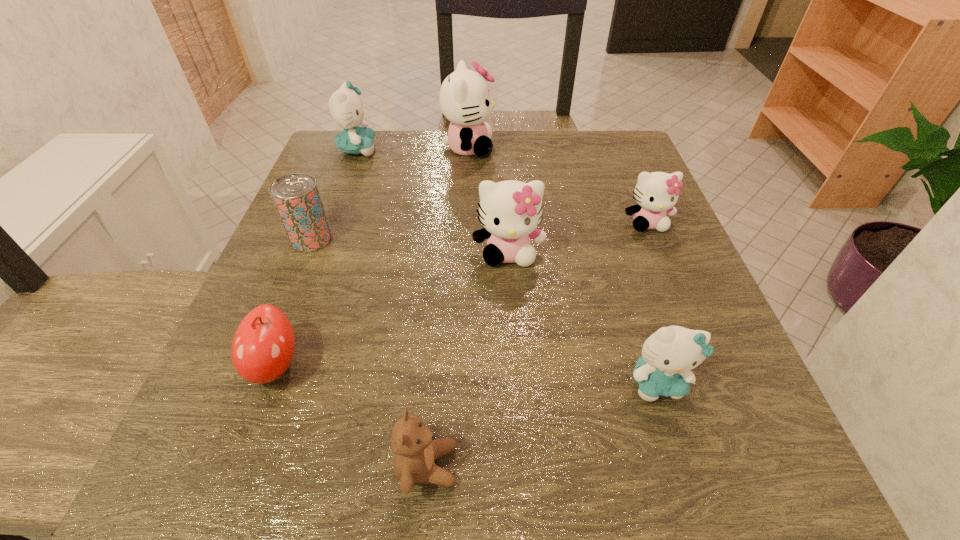
This screenshot has width=960, height=540. Find the location of `free spot between the smallest white kitten and the smaller blue kitten`. free spot between the smallest white kitten and the smaller blue kitten is located at coordinates (652, 302).

Choose which object is the fourth nearest neighbor to the farther blue kitten. Please provide its 2D coordinates. Your answer should be formatted as a tuple, i.e. [(x, y)], where the tuple contains the x and y coordinates of a point satisfying the conditions above.

[(263, 346)]

This screenshot has height=540, width=960. Find the location of `object that is the closest one to the red beer can`. object that is the closest one to the red beer can is located at coordinates coord(263,346).

At what (x,y) coordinates should I click in order to perform the action: click on the second closest kitten to the second biggest white kitten. Please return your answer as a coordinate pair (x, y). The image size is (960, 540). Looking at the image, I should click on (668, 355).

Locate an element on the screen. kitten identified as the fourth closest to the smallest white kitten is located at coordinates (345, 106).

Image resolution: width=960 pixels, height=540 pixels. I want to click on the closest white kitten to the apple, so click(510, 211).

At what (x,y) coordinates should I click in order to perform the action: click on white kitten identified as the closest to the red beer can. Please return your answer as a coordinate pair (x, y). The width and height of the screenshot is (960, 540). Looking at the image, I should click on (510, 211).

At what (x,y) coordinates should I click in order to perform the action: click on free space that satisfies the following two spatial constraints: 1. on the front-facing side of the second biggest white kitten; 2. on the front-facing side of the nearest object. Please return your answer as a coordinate pair (x, y). This screenshot has height=540, width=960. Looking at the image, I should click on (522, 465).